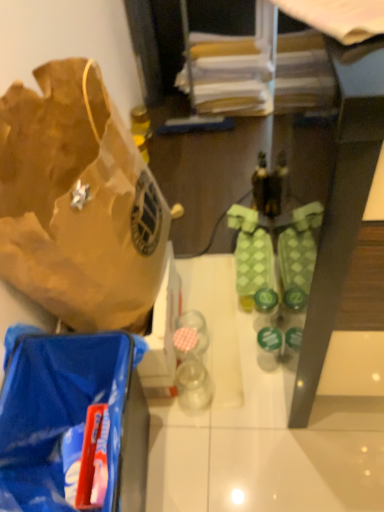
Question: From the image's perspective, relative to brown paper bag at left, is green matte bottle at center above or below?

Choices:
 (A) below
 (B) above

Answer: (A)

Question: Would you say green matte bottle at center is inside or outside brown paper bag at left?

Choices:
 (A) outside
 (B) inside

Answer: (A)

Question: Estimate the real-world distances between objects in this image. Which object is closer to the blue plastic bag at lower left?

Choices:
 (A) green textured socks at center
 (B) green matte bottle at center
 (C) brown paper bag at left

Answer: (C)

Question: Which object is positioned farthest from the green textured socks at center?

Choices:
 (A) green matte bottle at center
 (B) blue plastic bag at lower left
 (C) brown paper bag at left

Answer: (B)